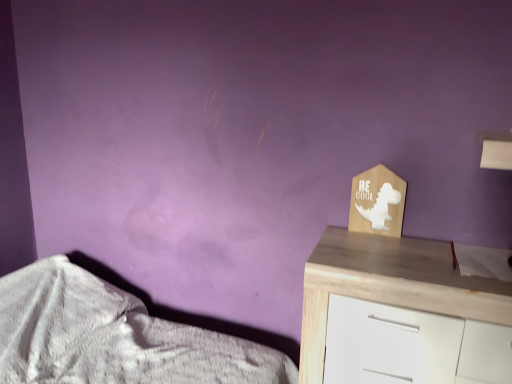
Question: Would you consider white textured fabric at lower left to be distant from wooden chest of drawers at right?

Choices:
 (A) no
 (B) yes

Answer: (A)

Question: From the image's perspective, is white textured fabric at lower left located above wooden chest of drawers at right?

Choices:
 (A) yes
 (B) no

Answer: (B)

Question: Would you say white textured fabric at lower left is outside wooden chest of drawers at right?

Choices:
 (A) no
 (B) yes

Answer: (B)

Question: Does white textured fabric at lower left lie behind wooden chest of drawers at right?

Choices:
 (A) yes
 (B) no

Answer: (B)

Question: Is white textured fabric at lower left directly adjacent to wooden chest of drawers at right?

Choices:
 (A) no
 (B) yes

Answer: (A)

Question: Considering the relative sizes of white textured fabric at lower left and wooden chest of drawers at right in the image provided, is white textured fabric at lower left thinner than wooden chest of drawers at right?

Choices:
 (A) yes
 (B) no

Answer: (B)

Question: Is wooden chest of drawers at right facing away from white textured fabric at lower left?

Choices:
 (A) yes
 (B) no

Answer: (B)

Question: Does wooden chest of drawers at right appear on the right side of white textured fabric at lower left?

Choices:
 (A) no
 (B) yes

Answer: (B)

Question: Does wooden chest of drawers at right touch white textured fabric at lower left?

Choices:
 (A) no
 (B) yes

Answer: (A)

Question: Does wooden chest of drawers at right have a greater height compared to white textured fabric at lower left?

Choices:
 (A) no
 (B) yes

Answer: (B)

Question: From the image's perspective, is wooden chest of drawers at right below white textured fabric at lower left?

Choices:
 (A) yes
 (B) no

Answer: (B)

Question: Considering the relative sizes of wooden chest of drawers at right and white textured fabric at lower left in the image provided, is wooden chest of drawers at right smaller than white textured fabric at lower left?

Choices:
 (A) no
 (B) yes

Answer: (B)

Question: Looking at their shapes, would you say white textured fabric at lower left is wider or thinner than wooden chest of drawers at right?

Choices:
 (A) thin
 (B) wide

Answer: (B)